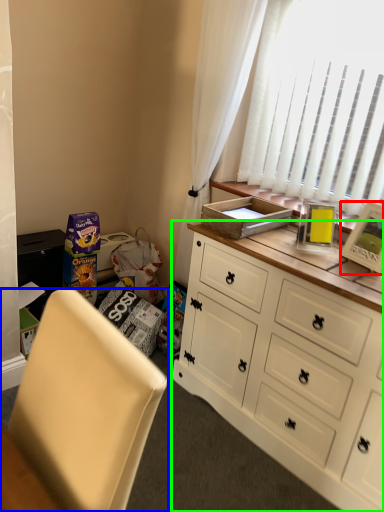
Question: Which object is positioned farthest from picture frame (highlighted by a red box)? Select from chair (highlighted by a blue box) and cabinetry (highlighted by a green box).

Choices:
 (A) chair
 (B) cabinetry

Answer: (A)